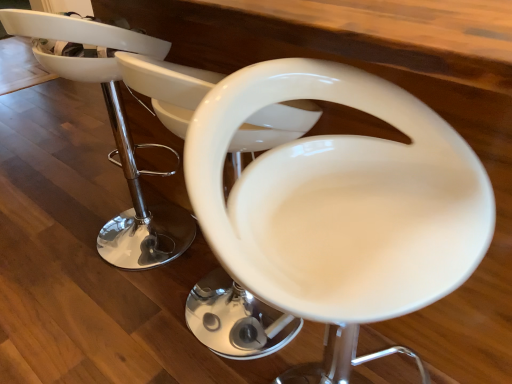
I want to click on white glossy bar stool at center, placed as the 2th feeding chair when sorted from back to front, so click(340, 200).

From the image's perspective, which feeding chair is the 1st one below the white glossy bar stool at center? Please provide its 2D coordinates.

[(234, 319)]

From the picture: Is white glossy bar stool at center far away from white glossy bar stool at center, which is the 1th feeding chair from back to front?

Actually, white glossy bar stool at center and white glossy bar stool at center, which is the 1th feeding chair from back to front, are a little close together.

Would you say white glossy bar stool at center is inside or outside white glossy bar stool at center, which is the 1th feeding chair from back to front?

white glossy bar stool at center exists outside the volume of white glossy bar stool at center, which is the 1th feeding chair from back to front.

In the image, is white glossy bar stool at center positioned in front of or behind white glossy bar stool at center, placed as the 2th feeding chair when sorted from back to front?

Clearly, white glossy bar stool at center is behind white glossy bar stool at center, placed as the 2th feeding chair when sorted from back to front.

Which is further, (39, 29) or (369, 216)?

Point (39, 29)

From a real-world perspective, which object rests below the other?

white glossy bar stool at center is physically lower.

From the image's perspective, starting from the white glossy bar stool at center, which feeding chair is the 2nd one below? Please provide its 2D coordinates.

[(340, 200)]

Measure the distance between white glossy bar stool at center, which is the 1th feeding chair from back to front, and white glossy bar stool at center, placed as the 2th feeding chair when sorted from back to front.

white glossy bar stool at center, which is the 1th feeding chair from back to front, is 8.20 inches from white glossy bar stool at center, placed as the 2th feeding chair when sorted from back to front.

Choose the correct answer: Is white glossy bar stool at center, which is the 2th feeding chair from front to back, inside white glossy bar stool at center, marked as the 1th feeding chair in a front-to-back arrangement, or outside it?

The correct answer is: outside.

Is white glossy bar stool at center, which is the 1th feeding chair from back to front, beside white glossy bar stool at center, placed as the 2th feeding chair when sorted from back to front?

No.

Can you confirm if white glossy bar stool at center, which is the 1th feeding chair from back to front, is shorter than white glossy bar stool at center, placed as the 2th feeding chair when sorted from back to front?

Incorrect, the height of white glossy bar stool at center, which is the 1th feeding chair from back to front, does not fall short of that of white glossy bar stool at center, placed as the 2th feeding chair when sorted from back to front.

Is white glossy bar stool at center, which is the 1th feeding chair from back to front, in front of or behind white glossy bar stool at center in the image?

Clearly, white glossy bar stool at center, which is the 1th feeding chair from back to front, is in front of white glossy bar stool at center.

Looking at this image, how many degrees apart are the facing directions of white glossy bar stool at center, which is the 2th feeding chair from front to back, and white glossy bar stool at center?

The facing directions of white glossy bar stool at center, which is the 2th feeding chair from front to back, and white glossy bar stool at center are 0.000468 degrees apart.

From the image's perspective, which object appears higher, white glossy bar stool at center, which is the 1th feeding chair from back to front, or white glossy bar stool at center?

From the image's view, white glossy bar stool at center is above.

Is point (232, 157) closer or farther from the camera than point (185, 235)?

Point (232, 157) appears to be closer to the viewer than point (185, 235).

From a real-world perspective, between white glossy bar stool at center, placed as the 2th feeding chair when sorted from back to front, and white glossy bar stool at center, who is vertically lower?

white glossy bar stool at center is physically lower.

In terms of height, does white glossy bar stool at center, placed as the 2th feeding chair when sorted from back to front, look taller or shorter compared to white glossy bar stool at center?

white glossy bar stool at center, placed as the 2th feeding chair when sorted from back to front, is shorter than white glossy bar stool at center.

Identify the location of chair on the left of white glossy bar stool at center, marked as the 1th feeding chair in a front-to-back arrangement. (112, 128).

In the scene shown: Is white glossy bar stool at center, placed as the 2th feeding chair when sorted from back to front, facing away from white glossy bar stool at center?

Correct, white glossy bar stool at center, placed as the 2th feeding chair when sorted from back to front, is looking away from white glossy bar stool at center.

How many degrees apart are the facing directions of white glossy bar stool at center, placed as the 2th feeding chair when sorted from back to front, and white glossy bar stool at center, which is the 1th feeding chair from back to front?

The facing directions of white glossy bar stool at center, placed as the 2th feeding chair when sorted from back to front, and white glossy bar stool at center, which is the 1th feeding chair from back to front, are 87 degrees apart.

Which object is further away from the camera taking this photo, white glossy bar stool at center, marked as the 1th feeding chair in a front-to-back arrangement, or white glossy bar stool at center, which is the 2th feeding chair from front to back?

white glossy bar stool at center, which is the 2th feeding chair from front to back, is behind.

Which is less distant, [390,175] or [224,351]?

Point [390,175].

I want to click on chair behind the white glossy bar stool at center, which is the 2th feeding chair from front to back, so 112,128.

Find the location of a particular element. The width and height of the screenshot is (512, 384). feeding chair that is the 2nd one when counting rightward from the white glossy bar stool at center is located at coordinates [x=340, y=200].

Based on their spatial positions, is white glossy bar stool at center, marked as the 1th feeding chair in a front-to-back arrangement, or white glossy bar stool at center, which is the 1th feeding chair from back to front, closer to white glossy bar stool at center?

white glossy bar stool at center, which is the 1th feeding chair from back to front, is closer to white glossy bar stool at center.

Based on their spatial positions, is white glossy bar stool at center, which is the 1th feeding chair from back to front, or white glossy bar stool at center, placed as the 2th feeding chair when sorted from back to front, closer to white glossy bar stool at center?

Among the two, white glossy bar stool at center, which is the 1th feeding chair from back to front, is located nearer to white glossy bar stool at center.

Which object lies further to the anchor point white glossy bar stool at center, placed as the 2th feeding chair when sorted from back to front, white glossy bar stool at center, which is the 1th feeding chair from back to front, or white glossy bar stool at center?

white glossy bar stool at center.

Looking at this image, from the image, which object appears to be nearer to white glossy bar stool at center, marked as the 1th feeding chair in a front-to-back arrangement, white glossy bar stool at center or white glossy bar stool at center, which is the 1th feeding chair from back to front?

Among the two, white glossy bar stool at center, which is the 1th feeding chair from back to front, is located nearer to white glossy bar stool at center, marked as the 1th feeding chair in a front-to-back arrangement.

Which object lies further to the anchor point white glossy bar stool at center, which is the 2th feeding chair from front to back, white glossy bar stool at center, marked as the 1th feeding chair in a front-to-back arrangement, or white glossy bar stool at center?

Among the two, white glossy bar stool at center is located further to white glossy bar stool at center, which is the 2th feeding chair from front to back.

When comparing their distances from white glossy bar stool at center, which is the 2th feeding chair from front to back, does white glossy bar stool at center or white glossy bar stool at center, marked as the 1th feeding chair in a front-to-back arrangement, seem closer?

Among the two, white glossy bar stool at center, marked as the 1th feeding chair in a front-to-back arrangement, is located nearer to white glossy bar stool at center, which is the 2th feeding chair from front to back.

At what (x,y) coordinates should I click in order to perform the action: click on feeding chair positioned between white glossy bar stool at center, marked as the 1th feeding chair in a front-to-back arrangement, and white glossy bar stool at center from near to far. Please return your answer as a coordinate pair (x, y). The height and width of the screenshot is (384, 512). Looking at the image, I should click on (234, 319).